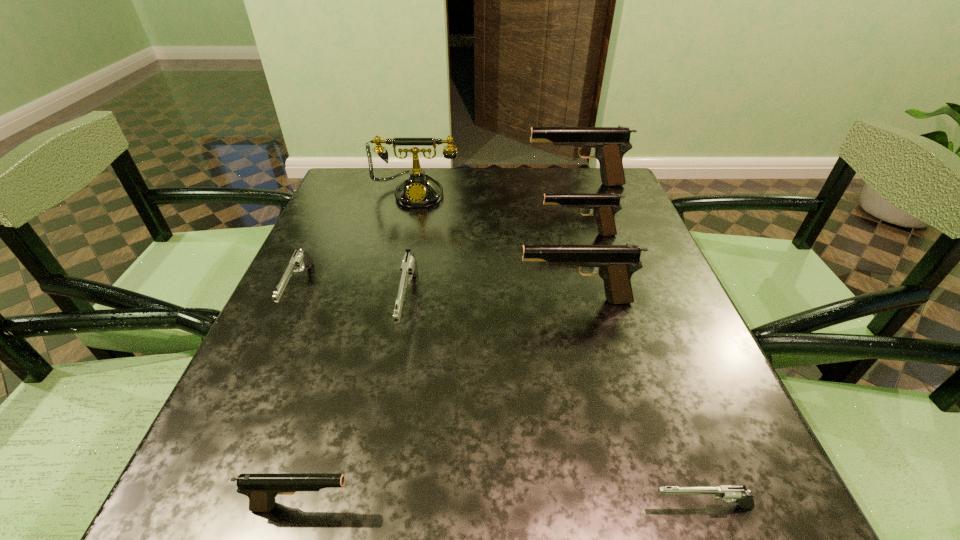
The image size is (960, 540). What are the coordinates of `vacant space that is in between the smallest black pistol and the fourth tallest object` in the screenshot? It's located at (441, 370).

The image size is (960, 540). Find the location of `vacant area between the nearest silver pistol and the third tallest object`. vacant area between the nearest silver pistol and the third tallest object is located at coordinates (638, 404).

You are a GUI agent. You are given a task and a screenshot of the screen. Output one action in this format:
    pyautogui.click(x=<x>, y=<y>)
    Task: Click on the free space that is in between the second pistol from left to right and the third farthest black pistol
    The width and height of the screenshot is (960, 540).
    Given the screenshot: What is the action you would take?
    pyautogui.click(x=440, y=403)

Find the location of `object that can be found as the second closest to the second smallest black pistol`. object that can be found as the second closest to the second smallest black pistol is located at coordinates (610, 144).

What are the coordinates of `object that is the third closest one to the sixth shortest pistol` in the screenshot? It's located at (417, 190).

Choose which pistol is the fifth nearest neighbor to the fifth pistol from right to left. Please provide its 2D coordinates. Your answer should be formatted as a tuple, i.e. [(x, y)], where the tuple contains the x and y coordinates of a point satisfying the conditions above.

[(610, 144)]

Where is `pistol that is the fifth nearest to the rightmost silver pistol`? The height and width of the screenshot is (540, 960). pistol that is the fifth nearest to the rightmost silver pistol is located at coordinates (300, 258).

Choose which black pistol is the third nearest neighbor to the smallest black pistol. Please provide its 2D coordinates. Your answer should be formatted as a tuple, i.e. [(x, y)], where the tuple contains the x and y coordinates of a point satisfying the conditions above.

[(610, 144)]

You are a GUI agent. You are given a task and a screenshot of the screen. Output one action in this format:
    pyautogui.click(x=<x>, y=<y>)
    Task: Click on the black pistol that is the closest to the nearest silver pistol
    
    Given the screenshot: What is the action you would take?
    pyautogui.click(x=615, y=264)

Select which silver pistol is the third closest to the farthest black pistol. Please provide its 2D coordinates. Your answer should be formatted as a tuple, i.e. [(x, y)], where the tuple contains the x and y coordinates of a point satisfying the conditions above.

[(728, 493)]